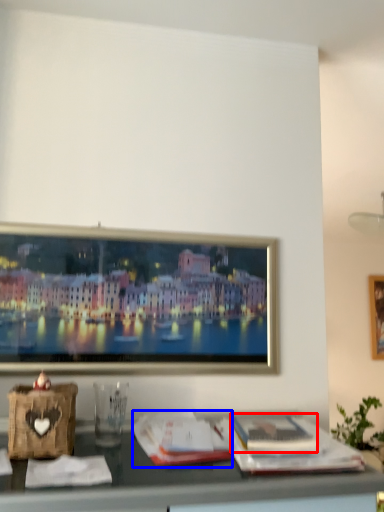
Question: Which object is closer to the camera taking this photo, magazine (highlighted by a red box) or magazine (highlighted by a blue box)?

Choices:
 (A) magazine
 (B) magazine

Answer: (B)